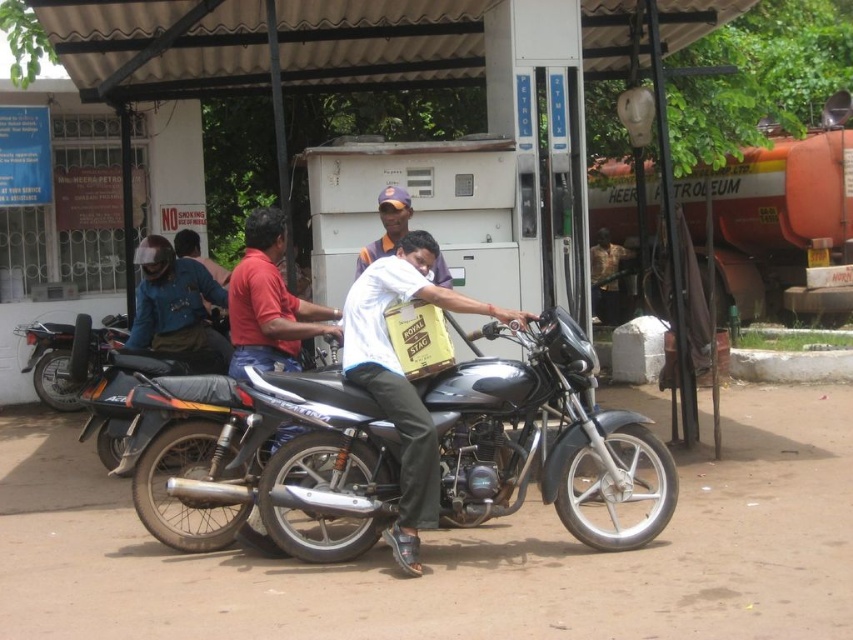
Which is more to the right, black matte motorcycle at left or white cotton shirt at center?

From the viewer's perspective, white cotton shirt at center appears more on the right side.

Locate an element on the screen. black matte motorcycle at left is located at coordinates (67, 356).

Is white matte shirt at center wider than matte black helmet at left?

Yes.

At what (x,y) coordinates should I click in order to perform the action: click on white matte shirt at center. Please return your answer as a coordinate pair (x, y). Looking at the image, I should click on (403, 378).

Which is more to the right, shiny black motorcycle at center or white cotton shirt at center?

From the viewer's perspective, shiny black motorcycle at center appears more on the right side.

Is shiny black motorcycle at center to the left of white cotton shirt at center from the viewer's perspective?

In fact, shiny black motorcycle at center is to the right of white cotton shirt at center.

Where is `shiny black motorcycle at center`? This screenshot has width=853, height=640. shiny black motorcycle at center is located at coordinates (543, 436).

Image resolution: width=853 pixels, height=640 pixels. What are the coordinates of `shiny black motorcycle at center` in the screenshot? It's located at (543, 436).